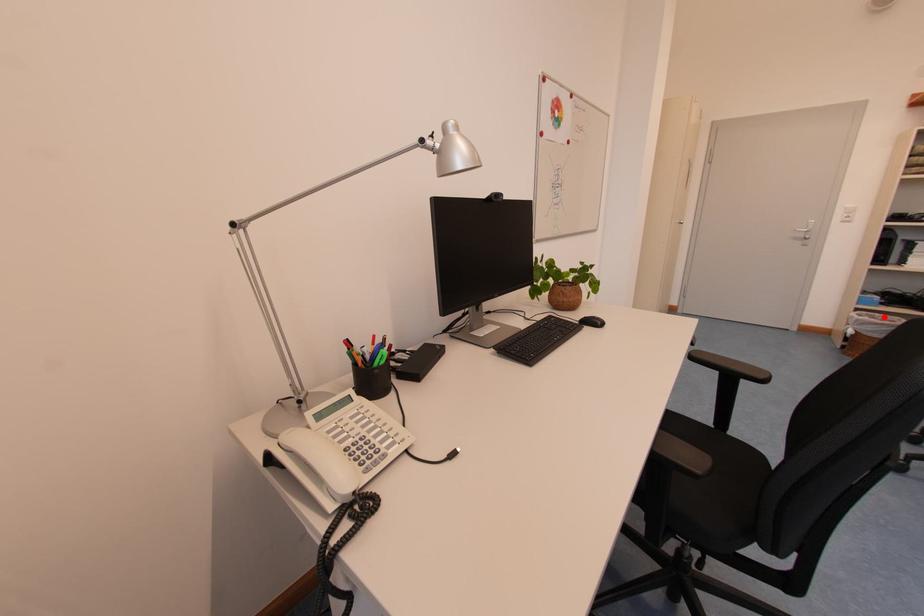
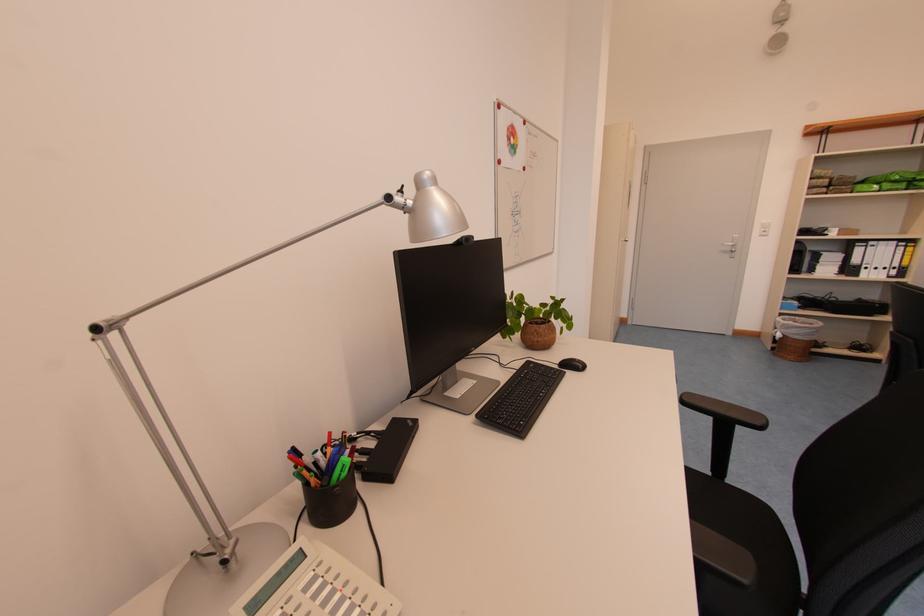
Where in the second image is the point corresponding to the highlighted location from the first image?

(805, 321)